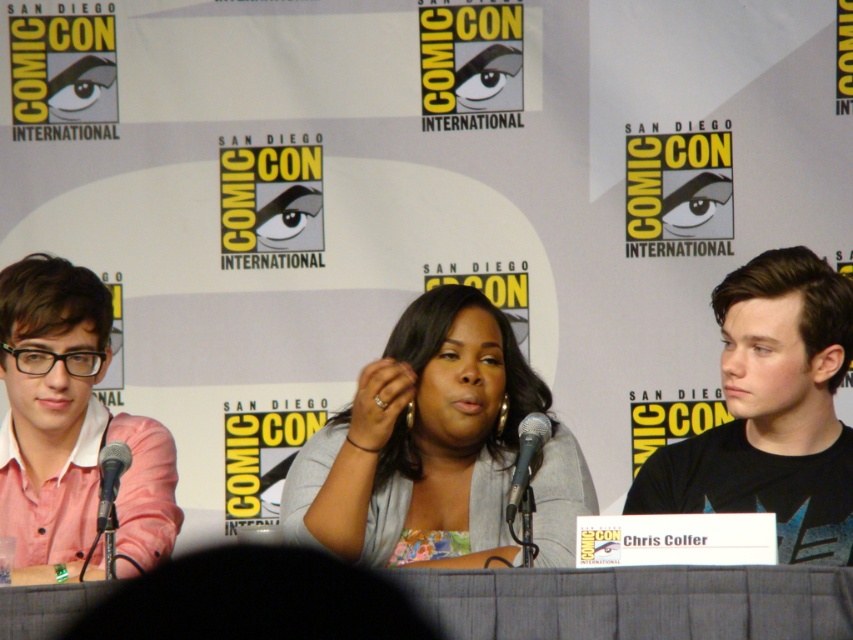
Question: Is black matte shirt at right positioned before metallic silver microphone at center?

Choices:
 (A) no
 (B) yes

Answer: (A)

Question: Which object is the farthest from the pink shirt at left?

Choices:
 (A) metallic silver microphone at center
 (B) black matte shirt at right

Answer: (B)

Question: Is the position of gray fabric at center more distant than that of black matte shirt at right?

Choices:
 (A) yes
 (B) no

Answer: (B)

Question: Which of these objects is positioned farthest from the black matte shirt at right?

Choices:
 (A) black metallic microphone at left
 (B) pink shirt at left
 (C) gray fabric at center
 (D) metallic silver microphone at center

Answer: (A)

Question: Does gray fabric at center appear over black metallic microphone at left?

Choices:
 (A) yes
 (B) no

Answer: (A)

Question: Which of these objects is positioned closest to the black matte shirt at right?

Choices:
 (A) black metallic microphone at left
 (B) gray fabric at center
 (C) pink shirt at left

Answer: (B)